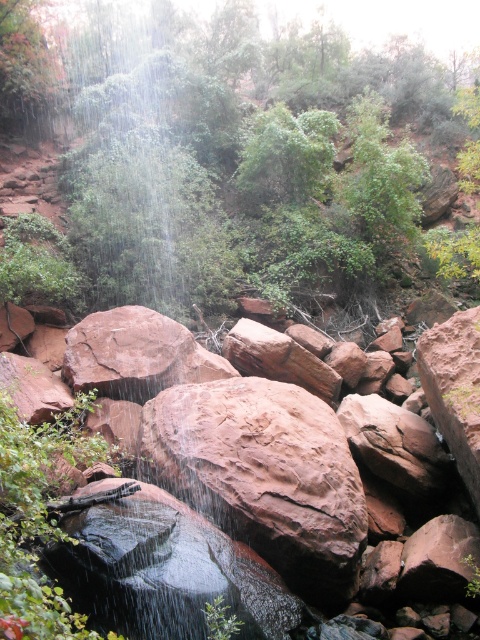
Question: Which object is the farthest from the reddish-brown rough rock at center?

Choices:
 (A) rusty rock at center
 (B) green mossy rock at upper left

Answer: (B)

Question: Can you confirm if reddish-brown rough rock at center is thinner than green mossy rock at upper left?

Choices:
 (A) yes
 (B) no

Answer: (A)

Question: Is rusty rock at center to the left of reddish-brown rough rock at center from the viewer's perspective?

Choices:
 (A) yes
 (B) no

Answer: (A)

Question: Which point is farther to the camera?

Choices:
 (A) (86, 269)
 (B) (312, 499)
 (C) (115, 536)

Answer: (A)

Question: Which object is closer to the camera taking this photo?

Choices:
 (A) rusty rock at center
 (B) green mossy rock at upper left

Answer: (A)

Question: Considering the relative positions of rusty rock at center and reddish-brown rough rock at center in the image provided, where is rusty rock at center located with respect to reddish-brown rough rock at center?

Choices:
 (A) right
 (B) left

Answer: (B)